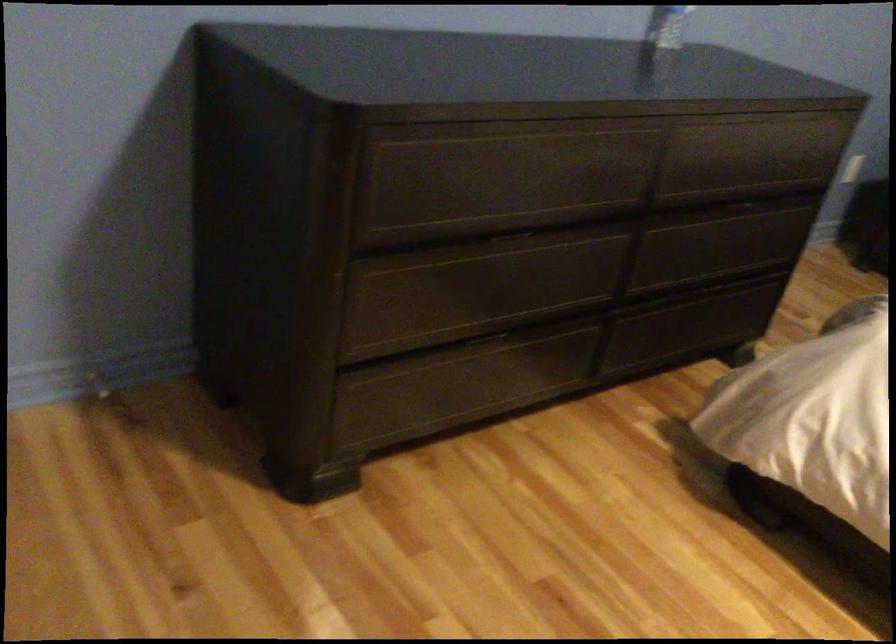
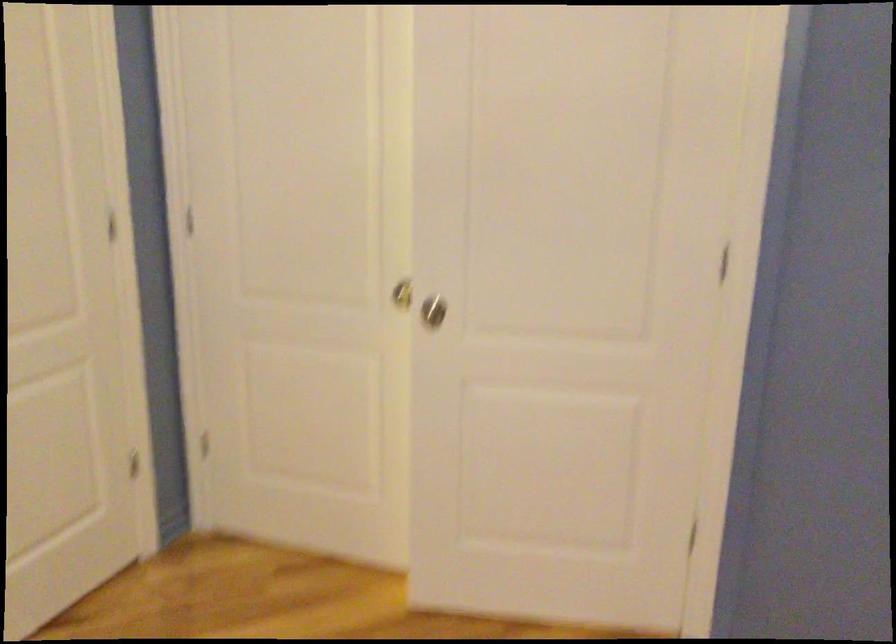
Question: The camera is either moving clockwise (left) or counter-clockwise (right) around the object. The first image is from the beginning of the video and the second image is from the end. Is the camera moving left or right when shooting the video?

Choices:
 (A) Left
 (B) Right

Answer: (B)